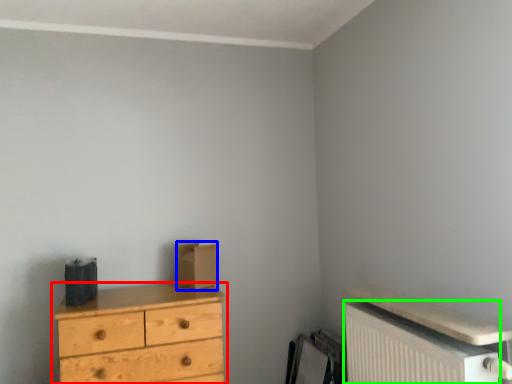
Question: Which object is the closest to the chest of drawers (highlighted by a red box)? Choose among these: cardboard box (highlighted by a blue box) or radiator (highlighted by a green box).

Choices:
 (A) cardboard box
 (B) radiator

Answer: (A)